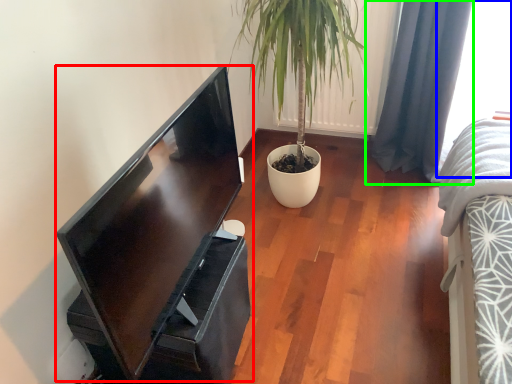
Question: Based on their relative distances, which object is farther from computer monitor (highlighted by a red box)? Choose from window (highlighted by a blue box) and curtain (highlighted by a green box).

Choices:
 (A) window
 (B) curtain

Answer: (A)